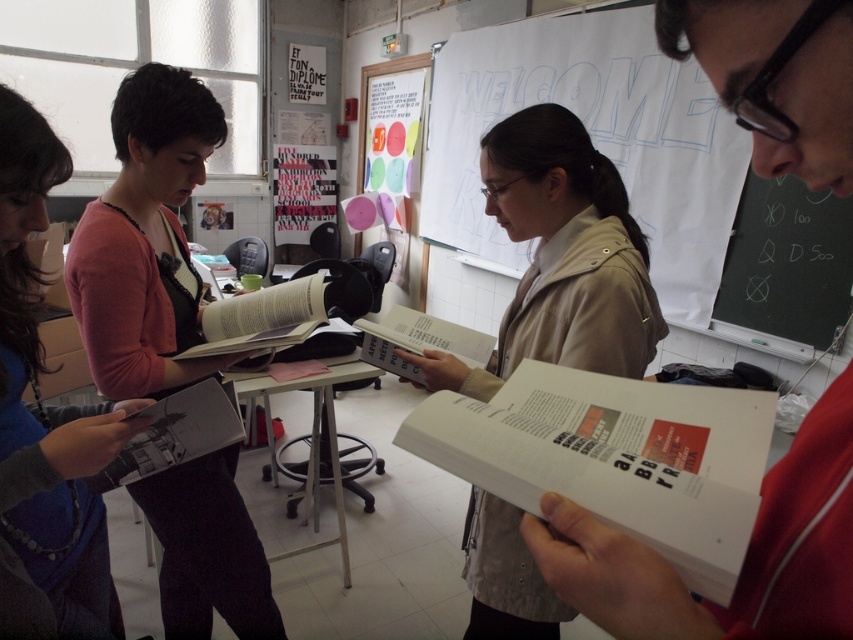
Question: Can you confirm if matte pink sweater at center is smaller than beige fabric jacket at center?

Choices:
 (A) yes
 (B) no

Answer: (B)

Question: Which object appears farthest from the camera in this image?

Choices:
 (A) white paper book at center
 (B) beige fabric jacket at center
 (C) matte pink sweater at center
 (D) white paper at upper center

Answer: (D)

Question: Observing the image, what is the correct spatial positioning of matte pink sweater at center in reference to beige fabric jacket at center?

Choices:
 (A) left
 (B) right

Answer: (A)

Question: Based on their relative distances, which object is nearer to the matte pink sweater at center?

Choices:
 (A) beige fabric jacket at center
 (B) white paper book at center

Answer: (A)

Question: Estimate the real-world distances between objects in this image. Which object is closer to the matte pink sweater at center?

Choices:
 (A) white paper at upper center
 (B) beige fabric jacket at center
 (C) white paper book at center

Answer: (B)

Question: Does white paper at upper center lie in front of matte pink sweater at center?

Choices:
 (A) yes
 (B) no

Answer: (B)